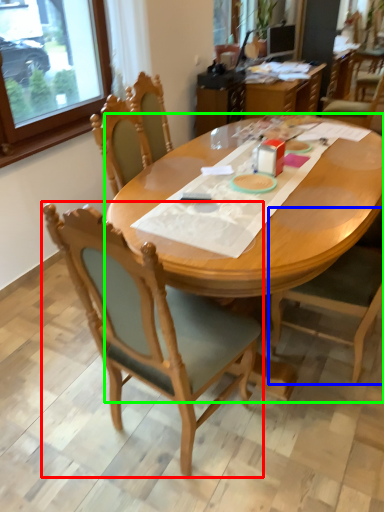
Question: Which object is positioned closest to chair (highlighted by a red box)? Select from chair (highlighted by a blue box) and desk (highlighted by a green box).

Choices:
 (A) chair
 (B) desk

Answer: (B)